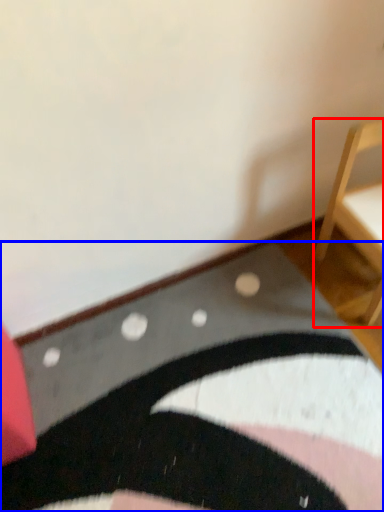
Question: Which object is closer to the camera taking this photo, furniture (highlighted by a red box) or mat (highlighted by a blue box)?

Choices:
 (A) furniture
 (B) mat

Answer: (B)